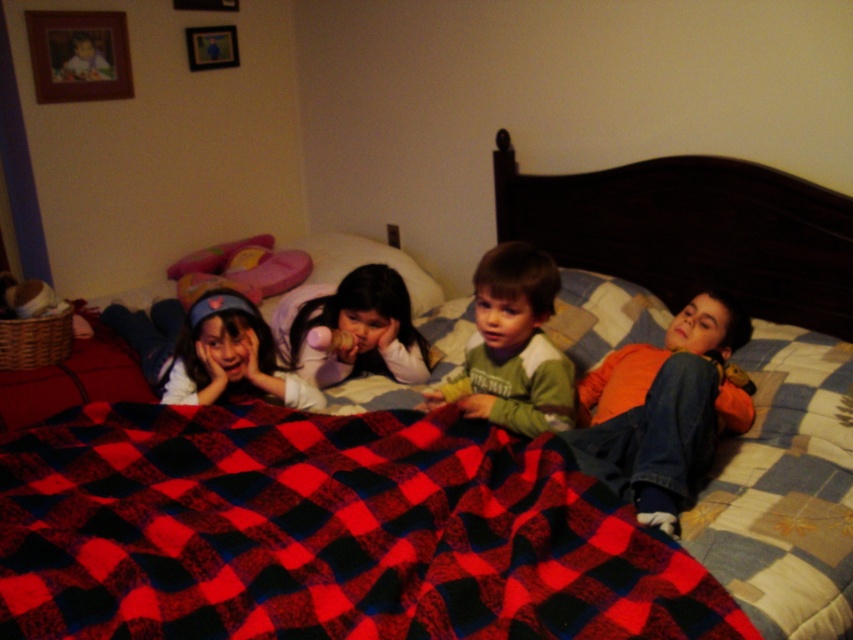
Question: Which of these objects is positioned farthest from the orange fleece shirt at right?

Choices:
 (A) matte white shirt at lower left
 (B) red plaid blanket at center

Answer: (A)

Question: From the image, what is the correct spatial relationship of red plaid blanket at center in relation to light purple fleece at center?

Choices:
 (A) below
 (B) above

Answer: (A)

Question: Which point is closer to the camera?

Choices:
 (A) (201, 38)
 (B) (735, 337)
 (C) (424, 289)
 (D) (589, 566)

Answer: (D)

Question: Which object appears closest to the camera in this image?

Choices:
 (A) green cotton shirt at center
 (B) orange fleece shirt at right

Answer: (B)

Question: Can you confirm if orange fleece shirt at right is wider than light purple fleece at center?

Choices:
 (A) no
 (B) yes

Answer: (B)

Question: Can you confirm if orange fleece shirt at right is positioned to the right of brushed metal picture frame at upper left?

Choices:
 (A) yes
 (B) no

Answer: (A)